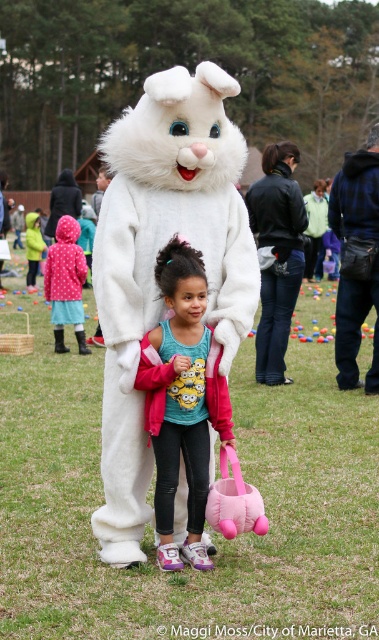
You are a parent at the Easter egg hunt and need to locate your child who is wearing a matte pink jacket at center and a pink polka dot coat at left. Which clothing item is lower in position?

The matte pink jacket at center is below the pink polka dot coat at left, so the matte pink jacket at center is lower in position.